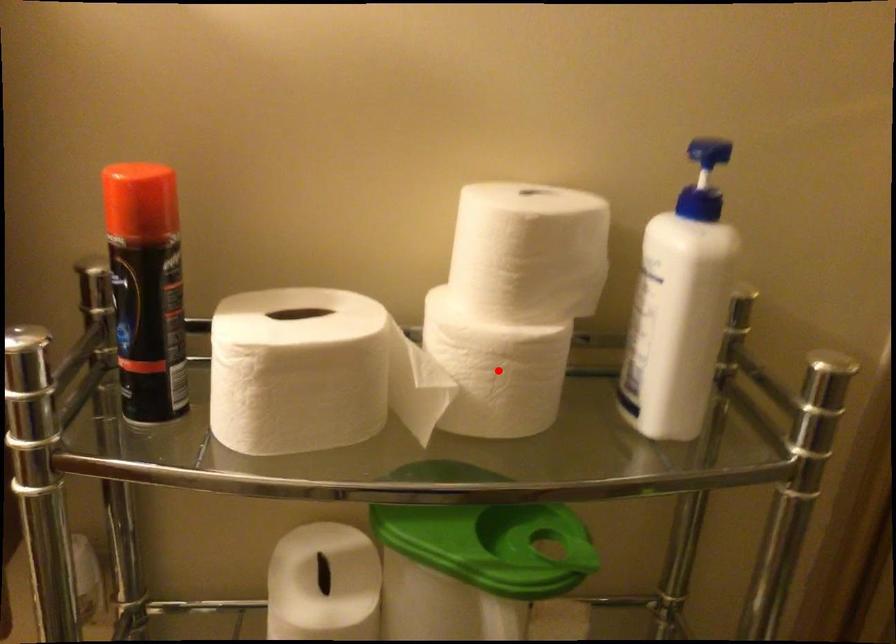
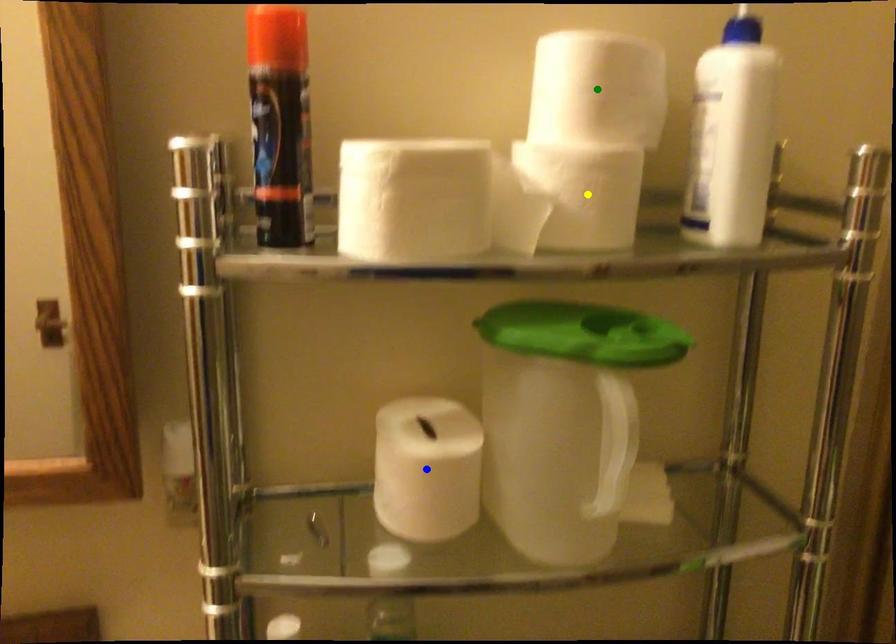
Question: I am providing you with two images of the same scene from different viewpoints. A red point is marked on the first image. You are given multiple points on the second image. Which point in image 2 is actually the same real-world point as the red point in image 1?

Choices:
 (A) yellow point
 (B) blue point
 (C) green point

Answer: (A)